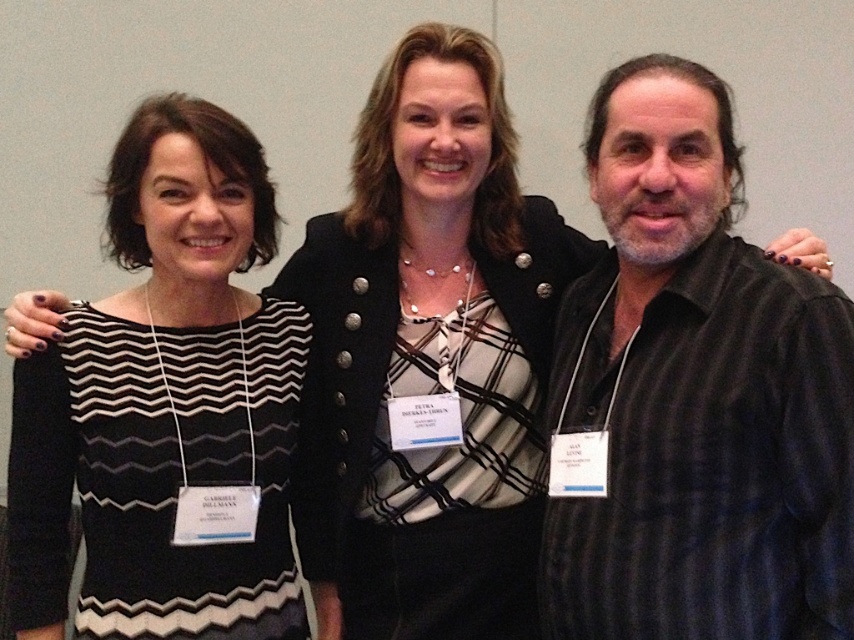
You are organizing a photo shoot and need to arrange the black striped shirt at right and the black striped dress at left in a line. Which one should you place first if you want the taller item to be positioned at the beginning of the line?

The black striped dress at left should be placed first because it is taller than the black striped shirt at right.

You are organizing a photo shoot and need to arrange the models according to their clothing from left to right. Given the black striped shirt at right and the black striped dress at left, which one should be placed on the left side of the arrangement?

The black striped dress at left should be placed on the left side of the arrangement because it is already positioned to the left of the black striped shirt at right in the original image.